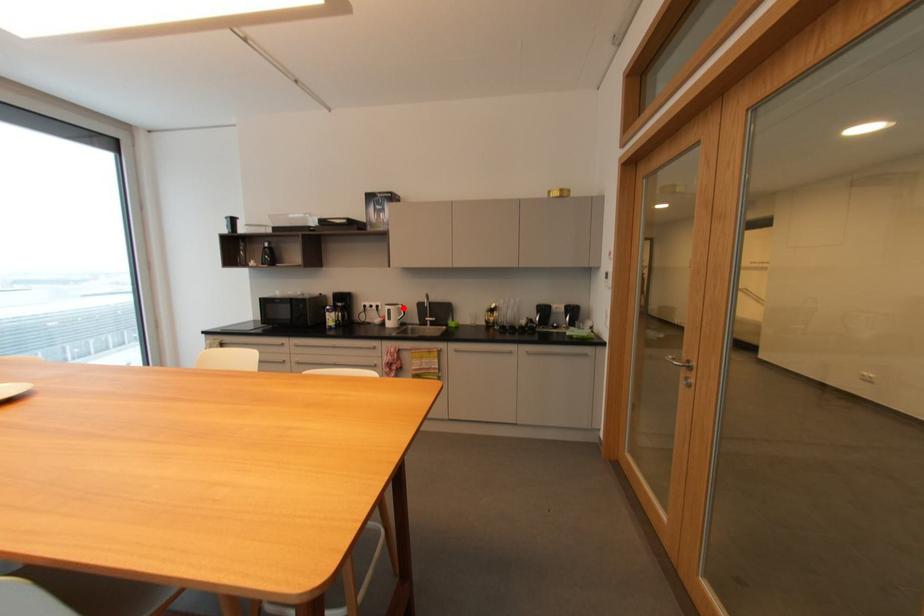
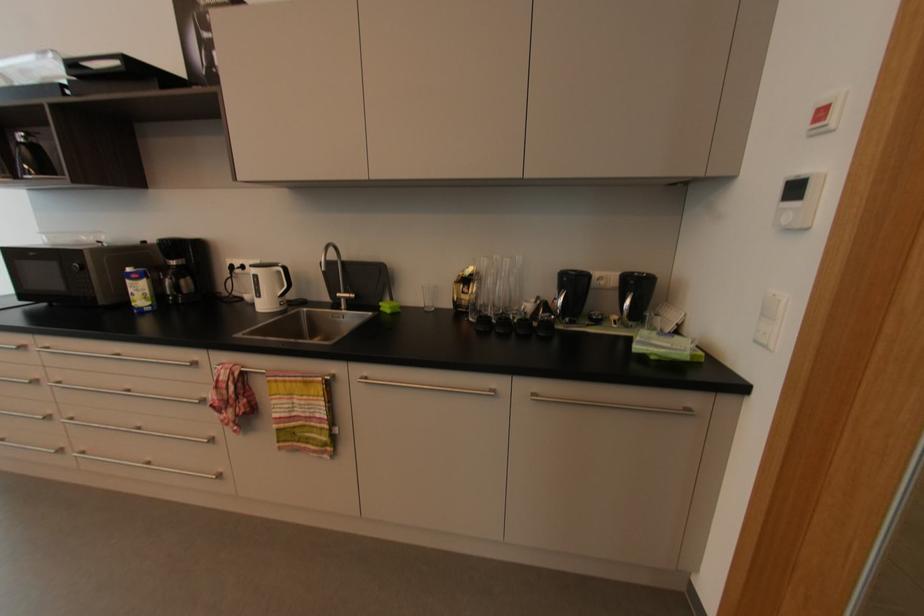
Locate, in the second image, the point that corresponds to the highlighted location in the first image.

(282, 273)